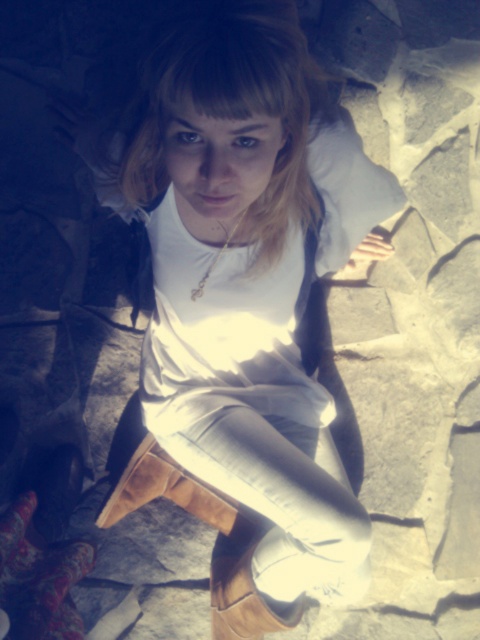
Who is more forward, (362, 522) or (208, 272)?

Point (208, 272) is in front.

Is white leather boots at center taller than gold chain necklace at center?

Correct, white leather boots at center is much taller as gold chain necklace at center.

Identify the location of white leather boots at center. The height and width of the screenshot is (640, 480). (248, 301).